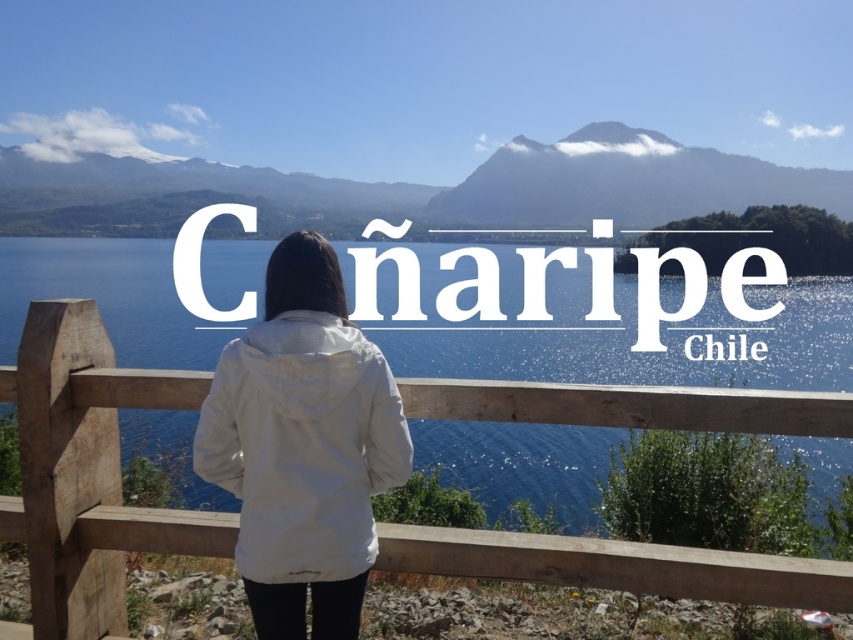
Looking at this image, between snowy mountain at upper center and dark gray rocky mountain at upper center, which one appears on the right side from the viewer's perspective?

dark gray rocky mountain at upper center is more to the right.

Where is `snowy mountain at upper center`? The image size is (853, 640). snowy mountain at upper center is located at coordinates (447, 188).

This screenshot has width=853, height=640. Find the location of `snowy mountain at upper center`. snowy mountain at upper center is located at coordinates (447, 188).

Between wooden at center and snowy mountain at upper center, which one appears on the right side from the viewer's perspective?

Positioned to the right is snowy mountain at upper center.

Who is more forward, (396,541) or (585,214)?

Point (396,541) is more forward.

Is point (80, 467) positioned in front of point (361, 216)?

Yes, point (80, 467) is closer to viewer.

At what (x,y) coordinates should I click in order to perform the action: click on wooden at center. Please return your answer as a coordinate pair (x, y). This screenshot has height=640, width=853. Looking at the image, I should click on (88, 472).

Is wooden at center to the right of dark gray rocky mountain at upper center from the viewer's perspective?

No, wooden at center is not to the right of dark gray rocky mountain at upper center.

Is point (77, 504) positioned behind point (602, 141)?

No, it is in front of (602, 141).

Is point (697, 419) positioned in front of point (506, 157)?

Yes, it is in front of point (506, 157).

Where is `wooden at center`? This screenshot has height=640, width=853. wooden at center is located at coordinates (88, 472).